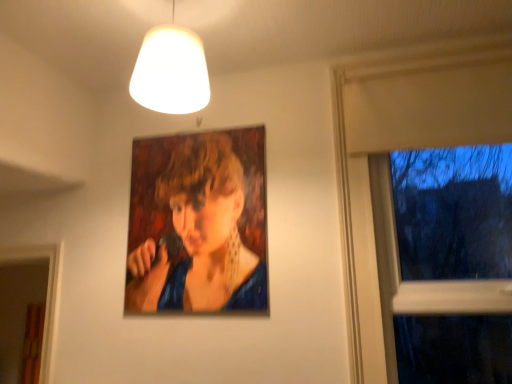
Question: Is white matte lampshade at upper center not inside oil painting portrait at center?

Choices:
 (A) yes
 (B) no

Answer: (A)

Question: From a real-world perspective, does white matte lampshade at upper center sit lower than oil painting portrait at center?

Choices:
 (A) no
 (B) yes

Answer: (A)

Question: Does white matte lampshade at upper center have a smaller size compared to oil painting portrait at center?

Choices:
 (A) no
 (B) yes

Answer: (A)

Question: From the image's perspective, is white matte lampshade at upper center on top of oil painting portrait at center?

Choices:
 (A) no
 (B) yes

Answer: (B)

Question: Is white matte lampshade at upper center shorter than oil painting portrait at center?

Choices:
 (A) yes
 (B) no

Answer: (A)

Question: Based on their sizes in the image, would you say white matte lampshade at upper center is bigger or smaller than transparent glass window at right?

Choices:
 (A) small
 (B) big

Answer: (A)

Question: From a real-world perspective, is white matte lampshade at upper center positioned above or below transparent glass window at right?

Choices:
 (A) above
 (B) below

Answer: (A)

Question: Is point (176, 79) closer or farther from the camera than point (449, 326)?

Choices:
 (A) farther
 (B) closer

Answer: (B)

Question: From the image's perspective, relative to transparent glass window at right, is white matte lampshade at upper center above or below?

Choices:
 (A) above
 (B) below

Answer: (A)

Question: Is transparent glass window at right wider or thinner than oil painting portrait at center?

Choices:
 (A) wide
 (B) thin

Answer: (A)

Question: From a real-world perspective, is transparent glass window at right above or below oil painting portrait at center?

Choices:
 (A) below
 (B) above

Answer: (A)

Question: Based on their sizes in the image, would you say transparent glass window at right is bigger or smaller than oil painting portrait at center?

Choices:
 (A) big
 (B) small

Answer: (A)

Question: From the image's perspective, is transparent glass window at right positioned above or below oil painting portrait at center?

Choices:
 (A) below
 (B) above

Answer: (B)

Question: Is oil painting portrait at center wider or thinner than transparent glass window at right?

Choices:
 (A) thin
 (B) wide

Answer: (A)

Question: Is oil painting portrait at center situated inside transparent glass window at right or outside?

Choices:
 (A) inside
 (B) outside

Answer: (B)